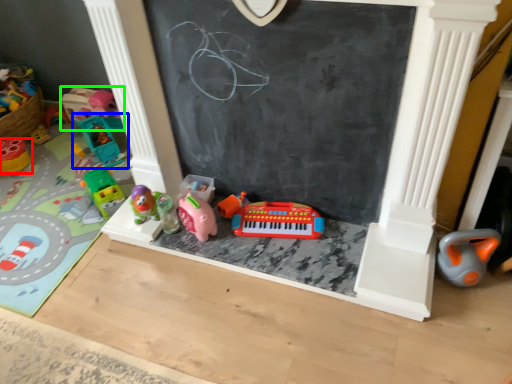
Question: Which object is the farthest from toy (highlighted by a red box)? Choose among these: toy (highlighted by a blue box) or toy (highlighted by a green box).

Choices:
 (A) toy
 (B) toy

Answer: (B)